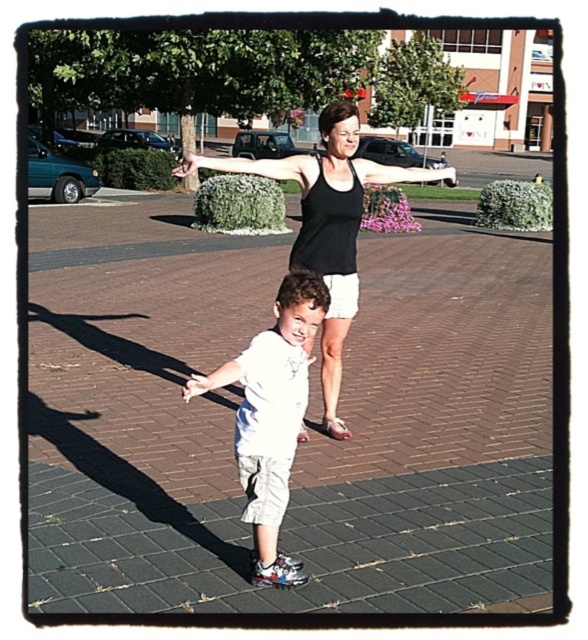
Question: Which object is farther from the camera taking this photo?

Choices:
 (A) white fabric arm at center
 (B) white cotton shirt at center
 (C) brick pavement at center

Answer: (C)

Question: From the image, what is the correct spatial relationship of black tank top at center in relation to white matte hand at center?

Choices:
 (A) right
 (B) left

Answer: (A)

Question: Does brick pavement at center appear under white fabric arm at center?

Choices:
 (A) yes
 (B) no

Answer: (B)

Question: Which of the following is the farthest from the observer?

Choices:
 (A) black tank top at center
 (B) white fabric arm at center
 (C) black matte tank top at upper center

Answer: (C)

Question: Where is brick pavement at center located in relation to white matte hand at center in the image?

Choices:
 (A) above
 (B) below

Answer: (A)

Question: Which point is closer to the camera taking this photo?

Choices:
 (A) (196, 374)
 (B) (329, 131)
 (C) (272, 168)

Answer: (C)